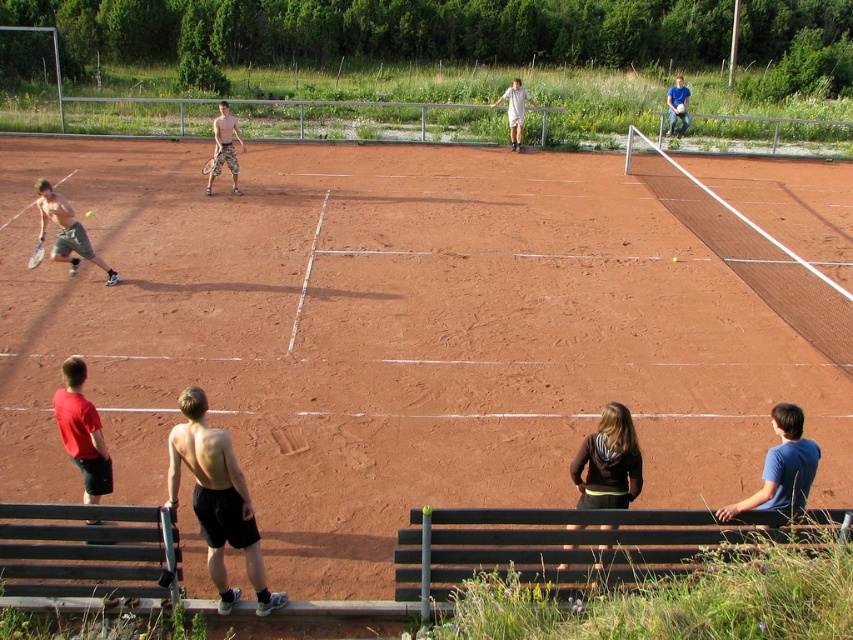
Question: Observing the image, what is the correct spatial positioning of black matte shorts at center in reference to matte black tennis racket at left?

Choices:
 (A) above
 (B) below

Answer: (B)

Question: Does black matte shorts at center have a smaller size compared to blue cotton shirt at lower right?

Choices:
 (A) yes
 (B) no

Answer: (B)

Question: Which object appears farthest from the camera in this image?

Choices:
 (A) black matte shorts at center
 (B) matte black tennis racket at left

Answer: (B)

Question: Which object appears closest to the camera in this image?

Choices:
 (A) matte black tennis racket at left
 (B) brown wooden bench at lower left
 (C) blue shirt at upper right

Answer: (B)

Question: Which point appears closest to the camera in this image?

Choices:
 (A) coord(33,259)
 (B) coord(143,360)
 (C) coord(393,557)
 (D) coord(78,576)

Answer: (D)

Question: Considering the relative positions of black matte shorts at center and blue shirt at upper right in the image provided, where is black matte shorts at center located with respect to blue shirt at upper right?

Choices:
 (A) above
 (B) below

Answer: (B)